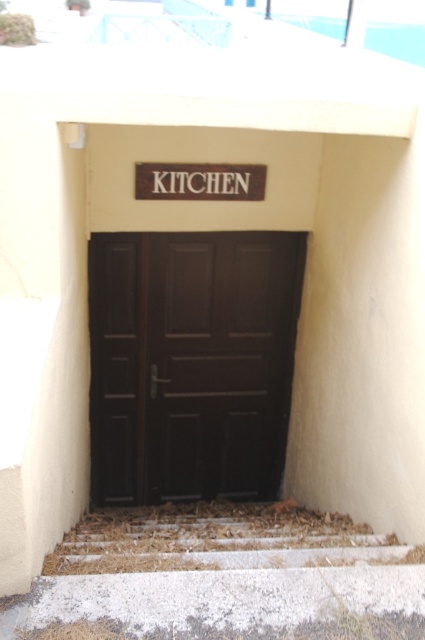
You are trying to hang a new sign above the matte dark brown door at center. The current brown wooden sign at center is already there. Can the new sign be larger than the existing one without overlapping?

The matte dark brown door at center is bigger than the brown wooden sign at center. Since the door is larger, there might be enough space above it to accommodate a larger sign without overlapping, provided the new sign fits within the available wall area.

You are a painter who needs to paint the brown wooden stairs at lower center and the brown wooden sign at center. Which object requires more paint due to its height?

The brown wooden stairs at lower center requires more paint because it is taller than the brown wooden sign at center.

You are standing in a hallway and see the matte dark brown door at center and the brown wooden sign at center. Which object is positioned higher up?

The brown wooden sign at center is positioned higher up since it is above the matte dark brown door at center.